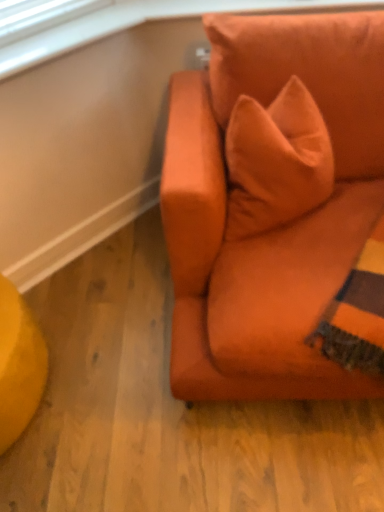
At what (x,y) coordinates should I click in order to perform the action: click on matte orange couch at upper right. Please return your answer as a coordinate pair (x, y). This screenshot has width=384, height=512. Looking at the image, I should click on (273, 211).

In order to face matte orange couch at upper right, should I rotate leftwards or rightwards?

To face it directly, rotate right by 15.453 degrees.

Image resolution: width=384 pixels, height=512 pixels. What do you see at coordinates (273, 211) in the screenshot?
I see `matte orange couch at upper right` at bounding box center [273, 211].

Image resolution: width=384 pixels, height=512 pixels. In order to click on matte orange couch at upper right in this screenshot , I will do `click(273, 211)`.